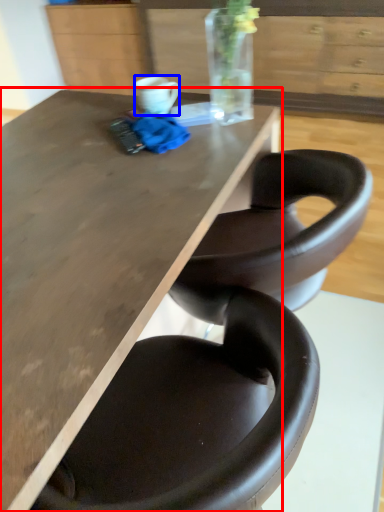
Question: Among these objects, which one is nearest to the camera, table (highlighted by a red box) or mug (highlighted by a blue box)?

Choices:
 (A) table
 (B) mug

Answer: (A)